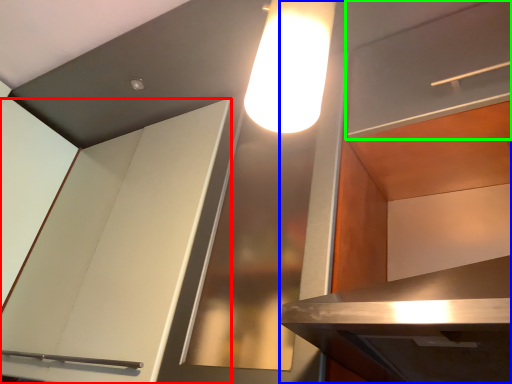
Question: Which object is the closest to the cabinetry (highlighted by a red box)? Choose among these: cabinetry (highlighted by a blue box) or shelf (highlighted by a green box).

Choices:
 (A) cabinetry
 (B) shelf

Answer: (A)